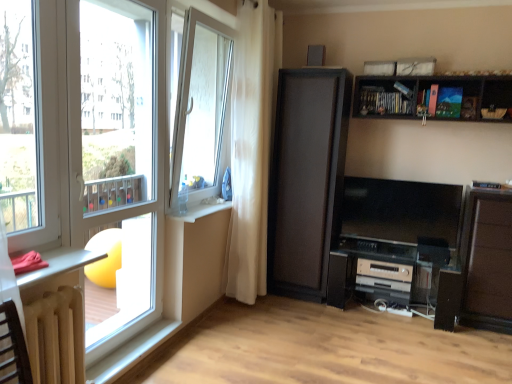
Question: In terms of size, does silver metallic stereo at lower center, the 2th appliance when ordered from top to bottom, appear bigger or smaller than white plastic window sill at lower left?

Choices:
 (A) small
 (B) big

Answer: (B)

Question: From a real-world perspective, relative to white plastic window sill at lower left, is silver metallic stereo at lower center, which ranks as the first appliance in bottom-to-top order, vertically above or below?

Choices:
 (A) below
 (B) above

Answer: (A)

Question: Which object is the closest to the white glass window at center, marked as the first window in a back-to-front arrangement?

Choices:
 (A) silver metallic stereo at lower center, the 2th appliance when ordered from top to bottom
 (B) matte black cabinet at lower right
 (C) brown wooden table at lower left, marked as the second table in a top-to-bottom arrangement
 (D) white plastic window frame at left
 (E) white plastic window sill at lower left

Answer: (D)

Question: Which is farther from the white plastic window frame at left?

Choices:
 (A) wooden dark brown shelf at upper right
 (B) black matte cabinet at center
 (C) metallic silver table at lower left, positioned as the 1th table in top-to-bottom order
 (D) white glass window at center, marked as the first window in a back-to-front arrangement
 (E) white plastic window at left, which ranks as the 1th window in front-to-back order

Answer: (A)